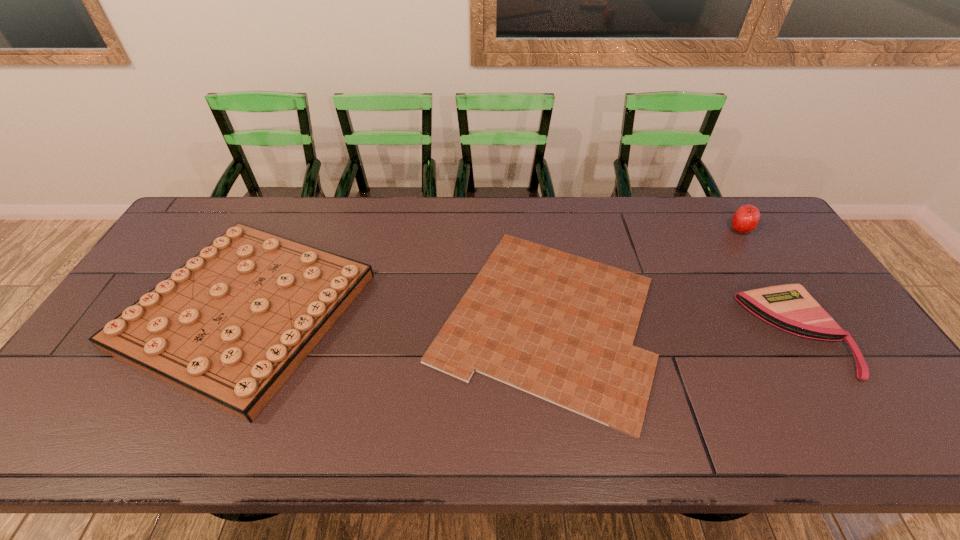
Where is `free space at the right edge of the desktop`? The width and height of the screenshot is (960, 540). free space at the right edge of the desktop is located at coordinates (771, 262).

This screenshot has height=540, width=960. In order to click on vacant region at the far left corner of the desktop in this screenshot , I will do `click(189, 230)`.

I want to click on vacant space that's between the shortest object and the taller gameboard, so click(396, 314).

Identify the location of empty space that is in between the tallest object and the right gameboard. This screenshot has width=960, height=540. (642, 274).

Locate an element on the screen. free space that is in between the third tallest object and the third object from right to left is located at coordinates (670, 325).

At what (x,y) coordinates should I click in order to perform the action: click on free space between the wristlet and the tallest object. Please return your answer as a coordinate pair (x, y). Looking at the image, I should click on (768, 281).

The width and height of the screenshot is (960, 540). What are the coordinates of `empty space that is in between the third shortest object and the shortest object` in the screenshot? It's located at (396, 314).

Choose which object is the nearest neighbor to the second shortest object. Please provide its 2D coordinates. Your answer should be formatted as a tuple, i.e. [(x, y)], where the tuple contains the x and y coordinates of a point satisfying the conditions above.

[(561, 327)]

At what (x,y) coordinates should I click in order to perform the action: click on the closest object to the right gameboard. Please return your answer as a coordinate pair (x, y). Looking at the image, I should click on (230, 326).

Find the location of `free space that satisfies the following two spatial constraints: 1. on the back side of the tallest object; 2. on the right side of the left gameboard`. free space that satisfies the following two spatial constraints: 1. on the back side of the tallest object; 2. on the right side of the left gameboard is located at coordinates (284, 230).